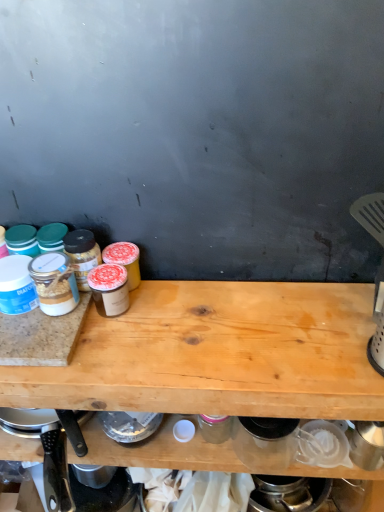
Question: Is point (54, 333) closer or farther from the camera than point (150, 457)?

Choices:
 (A) closer
 (B) farther

Answer: (A)

Question: In terms of size, does granite cutting board at left appear bigger or smaller than light brown wood at center?

Choices:
 (A) small
 (B) big

Answer: (A)

Question: Which object is the closest to the black plastic knife at lower left?

Choices:
 (A) granite cutting board at left
 (B) light brown wood at center

Answer: (A)

Question: Which of these objects is positioned farthest from the black plastic knife at lower left?

Choices:
 (A) light brown wood at center
 (B) granite cutting board at left

Answer: (A)